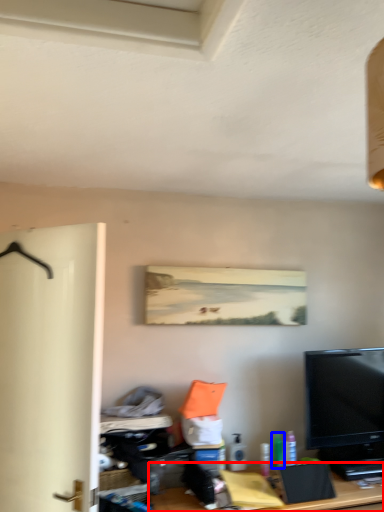
Question: Among these objects, which one is farthest to the camera, desk (highlighted by a red box) or toiletry (highlighted by a blue box)?

Choices:
 (A) desk
 (B) toiletry

Answer: (B)